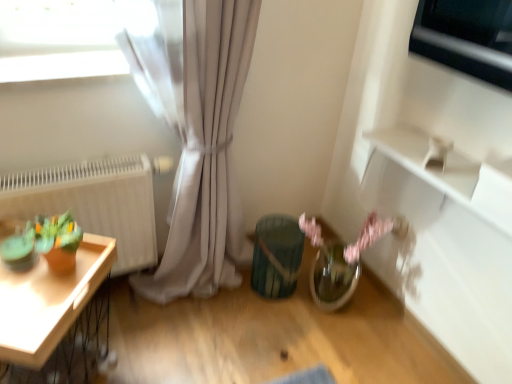
Question: From a real-world perspective, is teal textured vase at center positioned over white matte radiator at left based on gravity?

Choices:
 (A) yes
 (B) no

Answer: (B)

Question: Can you see teal textured vase at center touching white matte radiator at left?

Choices:
 (A) no
 (B) yes

Answer: (A)

Question: Does teal textured vase at center have a larger size compared to white matte radiator at left?

Choices:
 (A) no
 (B) yes

Answer: (A)

Question: From the image's perspective, is teal textured vase at center above white matte radiator at left?

Choices:
 (A) yes
 (B) no

Answer: (B)

Question: Is teal textured vase at center looking in the opposite direction of white matte radiator at left?

Choices:
 (A) no
 (B) yes

Answer: (A)

Question: Is point (96, 163) closer or farther from the camera than point (295, 249)?

Choices:
 (A) closer
 (B) farther

Answer: (A)

Question: In terms of height, does white matte radiator at left look taller or shorter compared to teal textured vase at center?

Choices:
 (A) short
 (B) tall

Answer: (B)

Question: Is white matte radiator at left in front of or behind teal textured vase at center in the image?

Choices:
 (A) front
 (B) behind

Answer: (A)

Question: From the image's perspective, is white matte radiator at left positioned above or below teal textured vase at center?

Choices:
 (A) above
 (B) below

Answer: (A)

Question: From their relative heights in the image, would you say wooden tray at left is taller or shorter than white matte radiator at left?

Choices:
 (A) tall
 (B) short

Answer: (B)

Question: Considering the positions of wooden tray at left and white matte radiator at left in the image, is wooden tray at left bigger or smaller than white matte radiator at left?

Choices:
 (A) big
 (B) small

Answer: (A)

Question: Considering the positions of wooden tray at left and white matte radiator at left in the image, is wooden tray at left wider or thinner than white matte radiator at left?

Choices:
 (A) thin
 (B) wide

Answer: (B)

Question: Is wooden tray at left in front of or behind white matte radiator at left in the image?

Choices:
 (A) front
 (B) behind

Answer: (A)

Question: Considering the positions of white matte radiator at left and wooden tray at left in the image, is white matte radiator at left wider or thinner than wooden tray at left?

Choices:
 (A) thin
 (B) wide

Answer: (A)

Question: Is point (66, 180) positioned closer to the camera than point (52, 307)?

Choices:
 (A) closer
 (B) farther

Answer: (B)